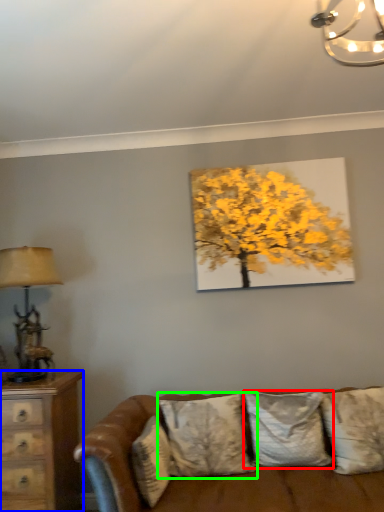
Question: Which object is the closest to the pillow (highlighted by a red box)? Choose among these: chest of drawers (highlighted by a blue box) or pillow (highlighted by a green box).

Choices:
 (A) chest of drawers
 (B) pillow

Answer: (B)